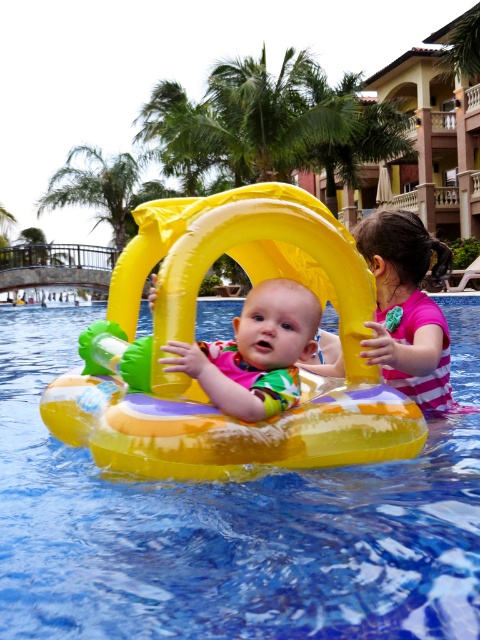
You are standing at the point labeled point (11, 520) and want to see the point labeled point (276, 360). Can you see it directly without moving?

Since point (11, 520) is behind point (276, 360), you cannot see point (276, 360) directly from your current position at point (11, 520) without moving.

You are a photographer positioned at the poolside. You need to capture a photo where both the pink striped swimsuit at right and the green leafy palm tree at upper left are visible. Considering their sizes, which object should you zoom in on to ensure both are in frame without cropping?

The pink striped swimsuit at right has a lesser width compared to green leafy palm tree at upper left. To include both in the frame without cropping, you should zoom in on the larger object, which is the green leafy palm tree at upper left, as it requires more space. However, since the swimsuit is smaller, adjusting the focus to include the palm tree while keeping the swimsuit in view would work best.